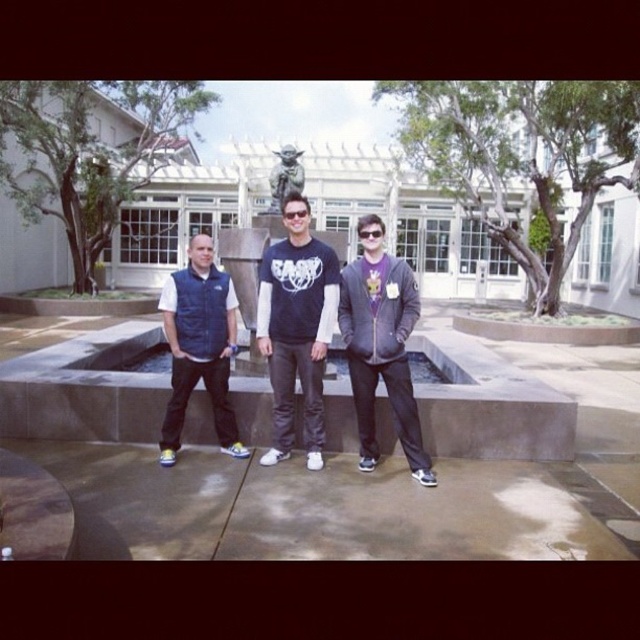
Does matte black t-shirt at center appear on the right side of matte gray hoodie at center?

No, matte black t-shirt at center is not to the right of matte gray hoodie at center.

Is matte black t-shirt at center wider than matte gray hoodie at center?

Correct, the width of matte black t-shirt at center exceeds that of matte gray hoodie at center.

The width and height of the screenshot is (640, 640). I want to click on matte black t-shirt at center, so pos(296,326).

At what (x,y) coordinates should I click in order to perform the action: click on matte black t-shirt at center. Please return your answer as a coordinate pair (x, y). The image size is (640, 640). Looking at the image, I should click on [296, 326].

Which of these two, matte black t-shirt at center or matte black goggles at center, stands taller?

Standing taller between the two is matte black t-shirt at center.

Who is shorter, matte black t-shirt at center or matte black goggles at center?

Standing shorter between the two is matte black goggles at center.

Does point (280, 394) lie behind point (381, 228)?

Yes, it is behind point (381, 228).

What are the coordinates of `matte black t-shirt at center` in the screenshot? It's located at (296, 326).

Between matte gray hoodie at center and navy blue vest at center, which one appears on the right side from the viewer's perspective?

matte gray hoodie at center is more to the right.

Does matte gray hoodie at center have a smaller size compared to navy blue vest at center?

Correct, matte gray hoodie at center occupies less space than navy blue vest at center.

Is point (372, 326) positioned before point (180, 317)?

Yes, point (372, 326) is closer to viewer.

This screenshot has width=640, height=640. I want to click on matte gray hoodie at center, so click(x=381, y=349).